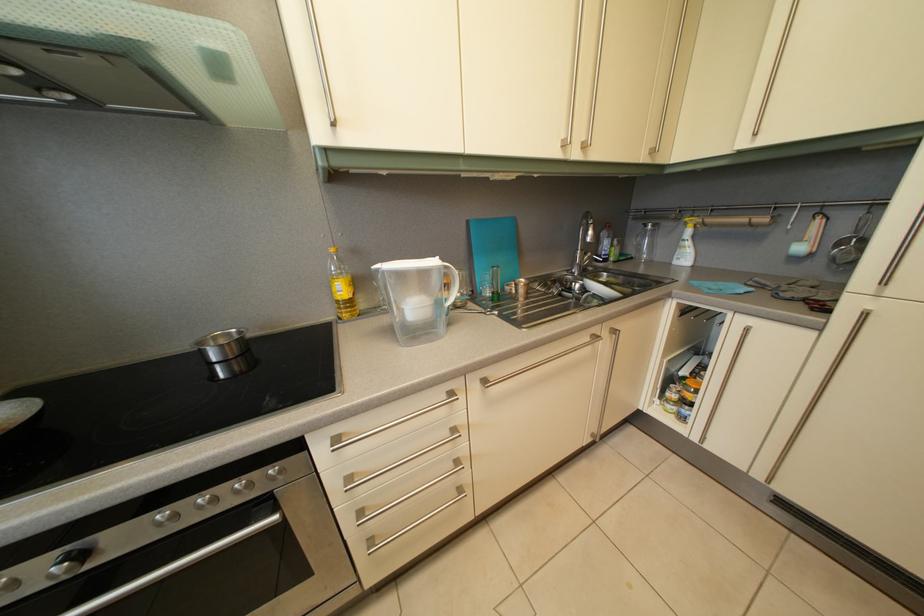
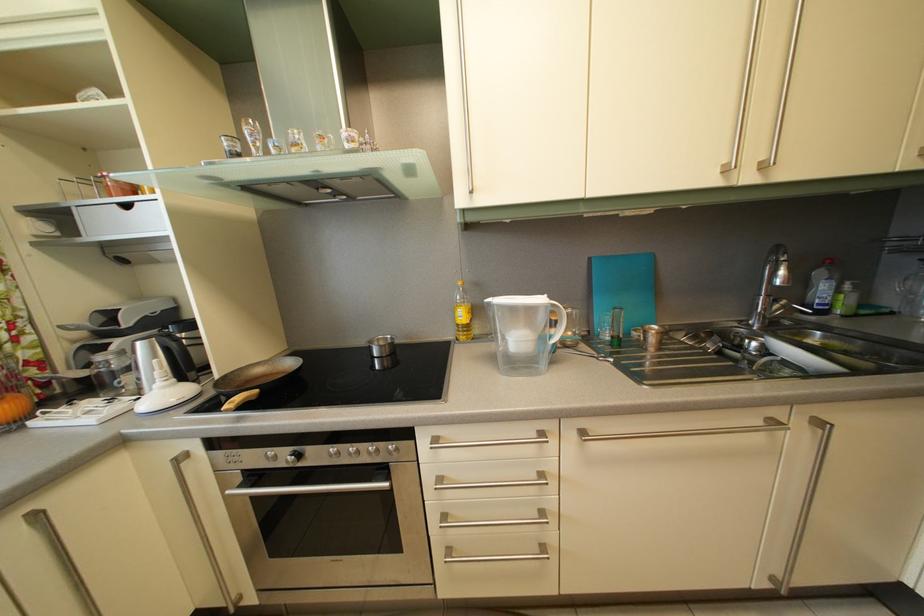
Question: The camera is either moving clockwise (left) or counter-clockwise (right) around the object. The first image is from the beginning of the video and the second image is from the end. Is the camera moving left or right when shooting the video?

Choices:
 (A) Left
 (B) Right

Answer: (B)